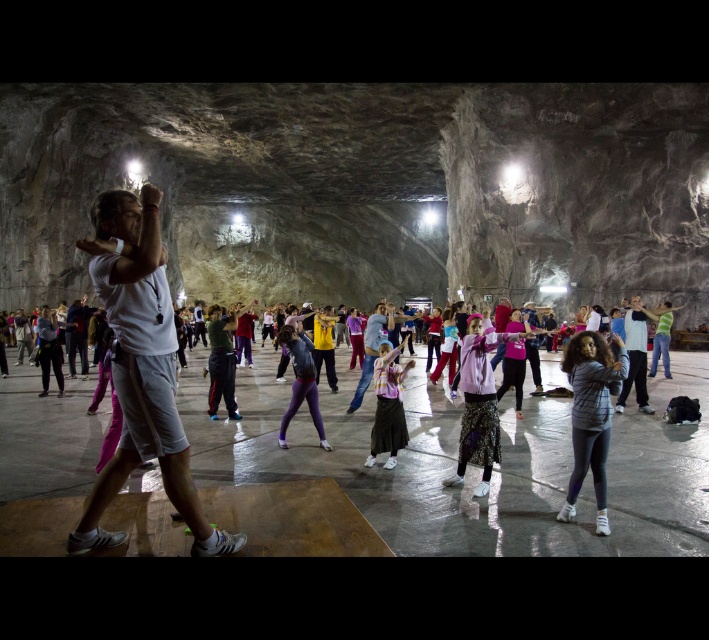
You are a photographer positioned at the back of the cavernous space. You need to capture a clear photo of both the white cotton shirt at center and the green fabric shirt at center. Which shirt will appear larger in the photo?

The white cotton shirt at center will appear larger in the photo because it is larger in size than the green fabric shirt at center.

You are standing at the entrance of the cavern and want to locate the pink fabric at center. Based on the coordinates provided, in which direction should you look to find it?

The pink fabric at center is located at coordinates point (479, 401), so you should look towards the center area of the cavern to find it.

You are standing at the entrance of the cavern and see the point marked as point (591,416). What object is located at that point?

The striped fabric shirt at center is located at point (591,416).